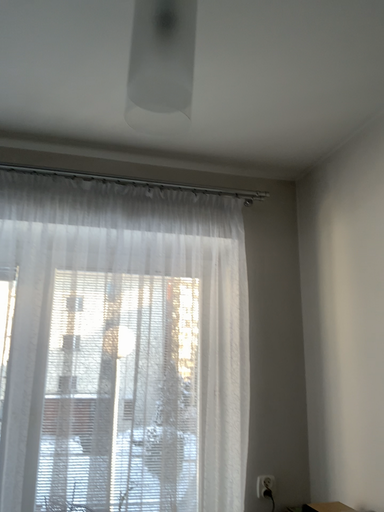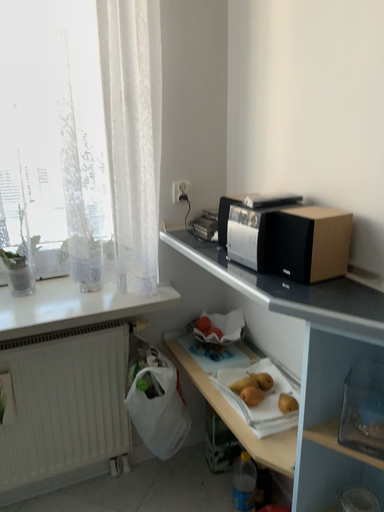
Question: Which way did the camera rotate in the video?

Choices:
 (A) rotated upward
 (B) rotated downward

Answer: (B)